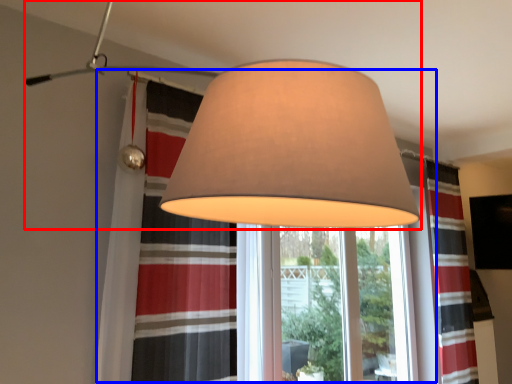
Question: Which point is further to the camera, lamp (highlighted by a red box) or bay window (highlighted by a blue box)?

Choices:
 (A) lamp
 (B) bay window

Answer: (B)